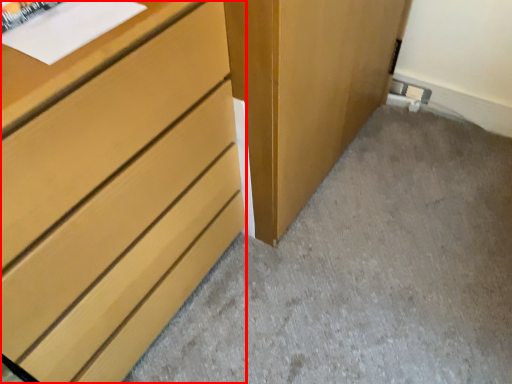
Question: From the image's perspective, what is the correct spatial positioning of chest of drawers (annotated by the red box) in reference to concrete?

Choices:
 (A) above
 (B) below

Answer: (A)